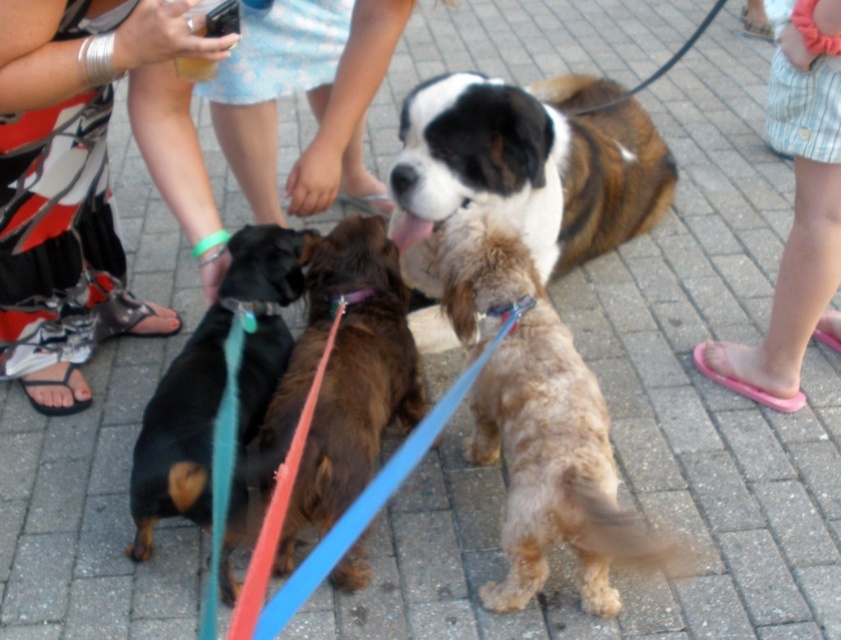
Does brown fuzzy dog at center have a lesser height compared to black smooth dachshund at left?

Incorrect, brown fuzzy dog at center's height does not fall short of black smooth dachshund at left's.

Image resolution: width=841 pixels, height=640 pixels. Find the location of `brown fuzzy dog at center`. brown fuzzy dog at center is located at coordinates (339, 381).

Can you confirm if brown/white fur at center is positioned to the right of black smooth dachshund at left?

Yes, brown/white fur at center is to the right of black smooth dachshund at left.

Is brown/white fur at center closer to the viewer compared to black smooth dachshund at left?

That is False.

The width and height of the screenshot is (841, 640). I want to click on brown/white fur at center, so click(x=533, y=161).

Does metallic silver sandals at lower left come in front of light blue denim shorts at center?

Yes.

Does metallic silver sandals at lower left have a greater height compared to light blue denim shorts at center?

Yes.

Describe the element at coordinates (83, 177) in the screenshot. I see `metallic silver sandals at lower left` at that location.

Where is `metallic silver sandals at lower left`? This screenshot has height=640, width=841. metallic silver sandals at lower left is located at coordinates (83, 177).